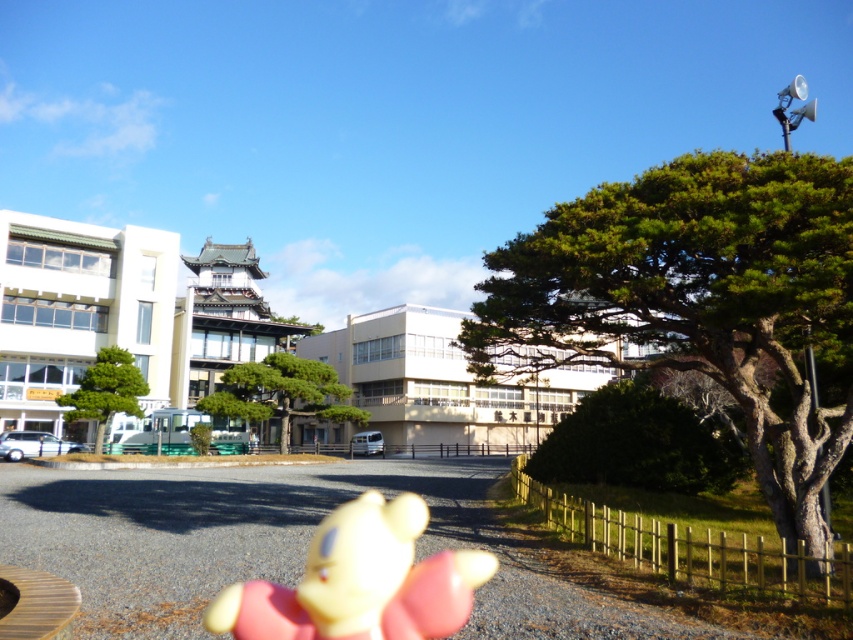
You are standing at the position of the yellow bear toy and want to walk to the point marked as point (120, 365). However, there is an obstacle at point (258, 593). Will you encounter this obstacle before reaching your destination?

Yes, you will encounter the obstacle at point (258, 593) before reaching point (120, 365) because point (258, 593) is in front of point (120, 365) from the bear toy.

You are a photographer setting up a shot with a yellow toy bear in the foreground and two green trees in the center. The trees are labeled as green textured tree at center and green matte tree at center. Which tree has a greater width?

The green textured tree at center has a greater width than the green matte tree at center.

You are a photographer setting up a shot of the green textured tree at right and the green textured tree at center. Which tree should you focus on if you want to capture the wider tree in your frame?

The green textured tree at right is wider than the green textured tree at center, so you should focus on the green textured tree at right to capture the wider tree in your frame.